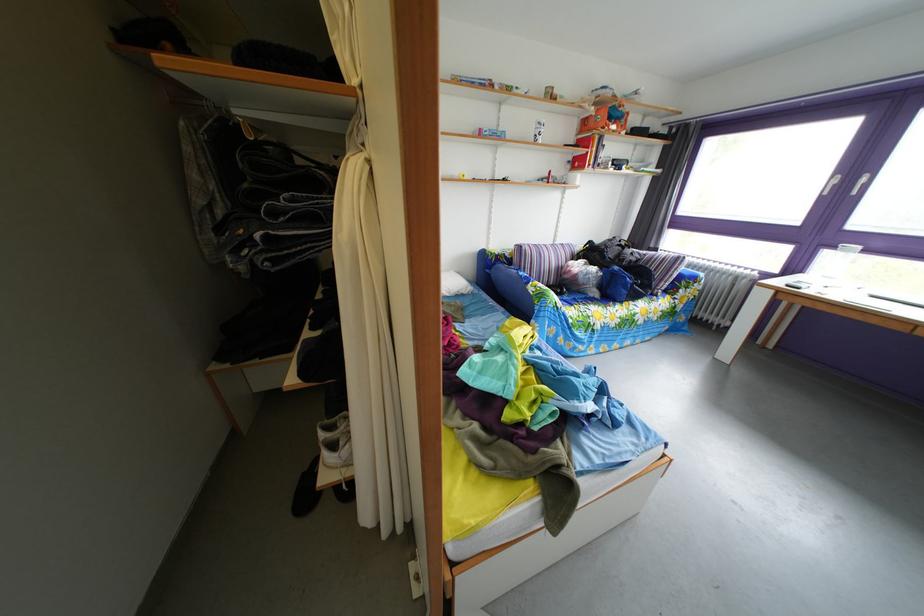
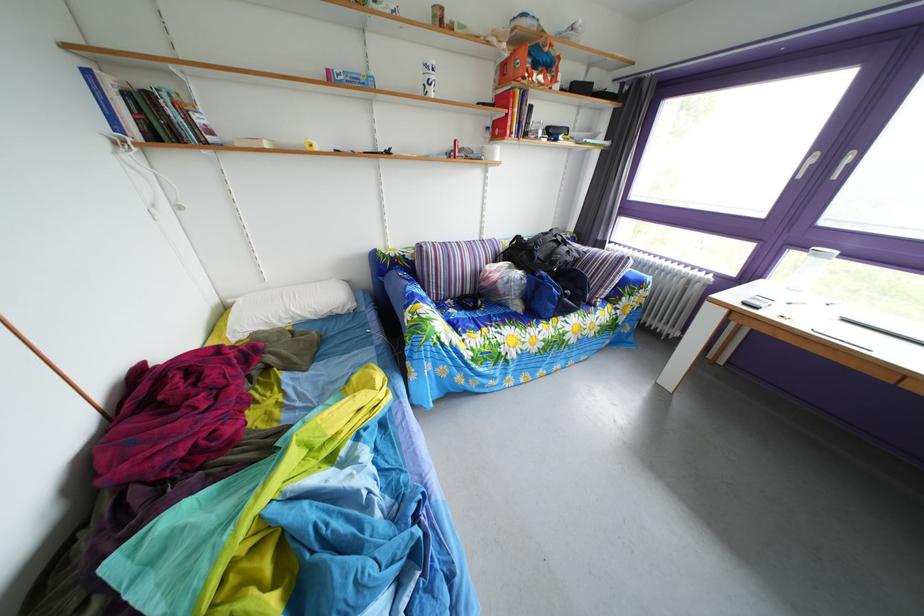
The point at (579, 169) is marked in the first image. Where is the corresponding point in the second image?

(499, 137)